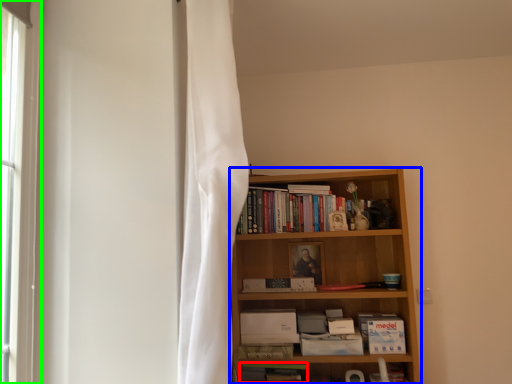
Question: Which object is positioned farthest from book (highlighted by a red box)? Select from bookcase (highlighted by a blue box) and bay window (highlighted by a green box).

Choices:
 (A) bookcase
 (B) bay window

Answer: (B)